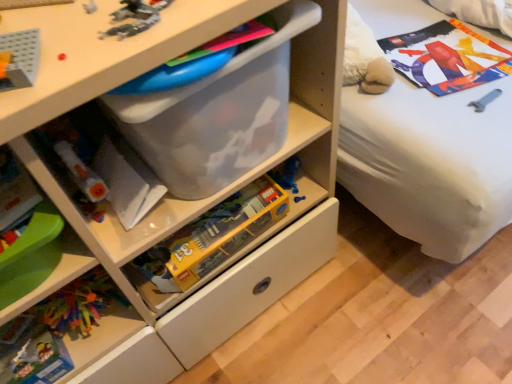
Question: Considering the relative sizes of multicolored plastic toys at lower left and translucent plastic toy at upper left, the second toy ordered from the bottom, in the image provided, is multicolored plastic toys at lower left bigger than translucent plastic toy at upper left, the second toy ordered from the bottom,?

Choices:
 (A) no
 (B) yes

Answer: (A)

Question: Are multicolored plastic toys at lower left and translucent plastic toy at upper left, positioned as the first toy in front-to-back order, making contact?

Choices:
 (A) no
 (B) yes

Answer: (A)

Question: From a real-world perspective, is multicolored plastic toys at lower left located beneath translucent plastic toy at upper left, which is counted as the 2th toy, starting from the back?

Choices:
 (A) yes
 (B) no

Answer: (A)

Question: From a real-world perspective, does multicolored plastic toys at lower left stand above translucent plastic toy at upper left, the first toy when ordered from top to bottom?

Choices:
 (A) yes
 (B) no

Answer: (B)

Question: Is multicolored plastic toys at lower left looking in the opposite direction of translucent plastic toy at upper left, the first toy when ordered from top to bottom?

Choices:
 (A) yes
 (B) no

Answer: (B)

Question: Does multicolored plastic toys at lower left have a smaller size compared to translucent plastic toy at upper left, positioned as the first toy in front-to-back order?

Choices:
 (A) yes
 (B) no

Answer: (A)

Question: Considering the relative sizes of transparent plastic chest of drawers at center and multicolored plastic toys at lower left in the image provided, is transparent plastic chest of drawers at center bigger than multicolored plastic toys at lower left?

Choices:
 (A) no
 (B) yes

Answer: (B)

Question: Considering the relative positions of transparent plastic chest of drawers at center and multicolored plastic toys at lower left in the image provided, is transparent plastic chest of drawers at center to the left of multicolored plastic toys at lower left from the viewer's perspective?

Choices:
 (A) yes
 (B) no

Answer: (A)

Question: Is transparent plastic chest of drawers at center shorter than multicolored plastic toys at lower left?

Choices:
 (A) no
 (B) yes

Answer: (A)

Question: Is transparent plastic chest of drawers at center positioned with its back to multicolored plastic toys at lower left?

Choices:
 (A) yes
 (B) no

Answer: (A)

Question: Is transparent plastic chest of drawers at center at the right side of multicolored plastic toys at lower left?

Choices:
 (A) no
 (B) yes

Answer: (A)

Question: Does transparent plastic chest of drawers at center have a greater width compared to multicolored plastic toys at lower left?

Choices:
 (A) no
 (B) yes

Answer: (B)

Question: Is transparent plastic chest of drawers at center positioned beyond the bounds of translucent plastic lego box at center, the first toy when ordered from bottom to top?

Choices:
 (A) yes
 (B) no

Answer: (A)